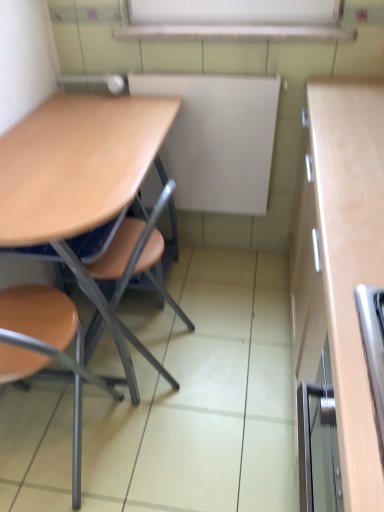
Question: Is the position of matte wood desk at left less distant than that of brown matte chair at left?

Choices:
 (A) no
 (B) yes

Answer: (A)

Question: Is matte wood desk at left thinner than brown matte chair at left?

Choices:
 (A) no
 (B) yes

Answer: (A)

Question: Is matte wood desk at left outside brown matte chair at left?

Choices:
 (A) no
 (B) yes

Answer: (B)

Question: Is matte wood desk at left wider than brown matte chair at left?

Choices:
 (A) yes
 (B) no

Answer: (A)

Question: Is matte wood desk at left oriented towards brown matte chair at left?

Choices:
 (A) no
 (B) yes

Answer: (A)

Question: Does point (77, 487) appear closer or farther from the camera than point (182, 159)?

Choices:
 (A) closer
 (B) farther

Answer: (A)

Question: In terms of size, does brown matte chair at left appear bigger or smaller than white matte board at center?

Choices:
 (A) small
 (B) big

Answer: (B)

Question: From a real-world perspective, is brown matte chair at left physically located above or below white matte board at center?

Choices:
 (A) below
 (B) above

Answer: (A)

Question: In terms of height, does brown matte chair at left look taller or shorter compared to white matte board at center?

Choices:
 (A) tall
 (B) short

Answer: (A)

Question: From a real-world perspective, is matte wood desk at left physically located above or below brown matte chair at left?

Choices:
 (A) above
 (B) below

Answer: (A)

Question: In terms of size, does matte wood desk at left appear bigger or smaller than brown matte chair at left?

Choices:
 (A) small
 (B) big

Answer: (B)

Question: In terms of height, does matte wood desk at left look taller or shorter compared to brown matte chair at left?

Choices:
 (A) short
 (B) tall

Answer: (B)

Question: From the image's perspective, is matte wood desk at left located above or below brown matte chair at left?

Choices:
 (A) above
 (B) below

Answer: (A)

Question: Considering the positions of matte wood desk at left and white matte board at center in the image, is matte wood desk at left wider or thinner than white matte board at center?

Choices:
 (A) wide
 (B) thin

Answer: (A)

Question: Considering the positions of matte wood desk at left and white matte board at center in the image, is matte wood desk at left bigger or smaller than white matte board at center?

Choices:
 (A) small
 (B) big

Answer: (B)